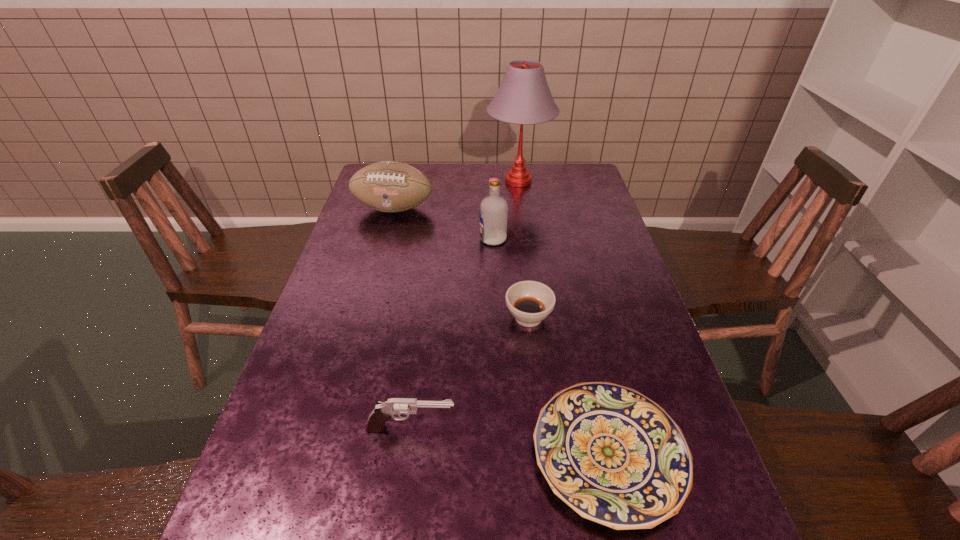
Where is `table lamp located at the right edge`? The image size is (960, 540). table lamp located at the right edge is located at coordinates (524, 97).

You are a GUI agent. You are given a task and a screenshot of the screen. Output one action in this format:
    pyautogui.click(x=<x>, y=<y>)
    Task: Click on the plate at the right edge
    
    Given the screenshot: What is the action you would take?
    pyautogui.click(x=614, y=456)

The width and height of the screenshot is (960, 540). I want to click on object at the far right corner, so click(x=524, y=97).

This screenshot has height=540, width=960. What are the coordinates of `free space at the left edge of the desktop` in the screenshot? It's located at (307, 358).

Locate an element on the screen. The width and height of the screenshot is (960, 540). vacant space at the right edge of the desktop is located at coordinates (612, 293).

Locate an element on the screen. Image resolution: width=960 pixels, height=540 pixels. vacant space at the far right corner of the desktop is located at coordinates (564, 180).

Where is `vacant area between the third shortest object and the fifth shortest object`? vacant area between the third shortest object and the fifth shortest object is located at coordinates (452, 334).

You are a GUI agent. You are given a task and a screenshot of the screen. Output one action in this format:
    pyautogui.click(x=<x>, y=<y>)
    Task: Click on the unoccupied position between the gun and the second shortest object
    
    Given the screenshot: What is the action you would take?
    pyautogui.click(x=469, y=373)

Where is `vacant region between the fifth tallest object and the football (American)`? The width and height of the screenshot is (960, 540). vacant region between the fifth tallest object and the football (American) is located at coordinates (461, 263).

You are a GUI agent. You are given a task and a screenshot of the screen. Output one action in this format:
    pyautogui.click(x=<x>, y=<y>)
    Task: Click on the free spot between the vodka and the football (American)
    The height and width of the screenshot is (540, 960).
    Given the screenshot: What is the action you would take?
    pyautogui.click(x=444, y=224)